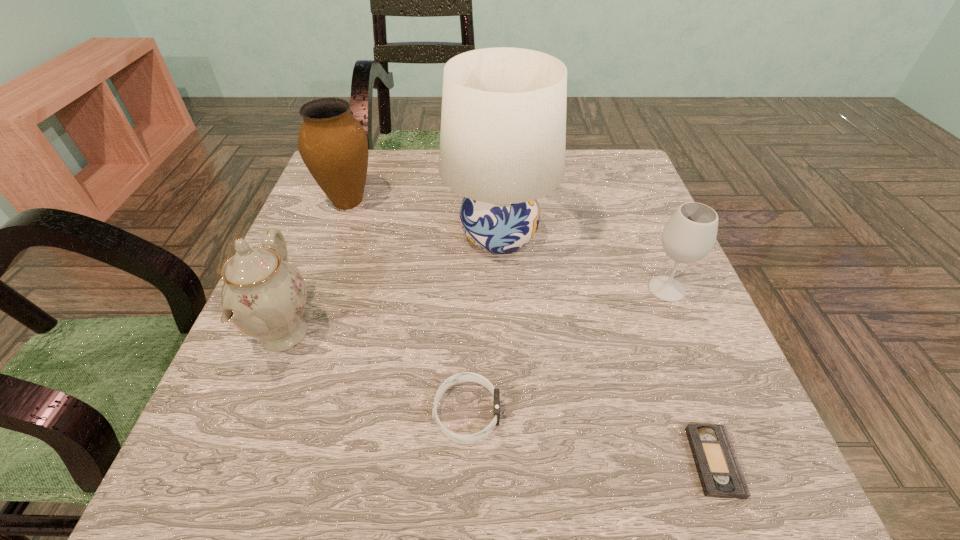
Find the location of a particular element. free region located 0.370m on the spout of the chinaware is located at coordinates (526, 334).

This screenshot has width=960, height=540. I want to click on vacant space situated 0.400m on the left of the fourth tallest object, so [x=441, y=289].

Image resolution: width=960 pixels, height=540 pixels. I want to click on vacant region located on the outer surface of the fifth tallest object, so click(x=726, y=413).

Identify the location of blank space located 0.130m on the back of the shortest object. (674, 356).

Where is `object located in the far edge section of the desktop`? The image size is (960, 540). object located in the far edge section of the desktop is located at coordinates (333, 145).

The height and width of the screenshot is (540, 960). What are the coordinates of `wristband located at the near edge` in the screenshot? It's located at (464, 376).

Find the location of a particular element. videotape positioned at the near edge is located at coordinates click(719, 471).

You are a GUI agent. You are given a task and a screenshot of the screen. Output one action in this format:
    pyautogui.click(x=<x>, y=<y>)
    Task: Click on the urn situated at the left edge
    Image resolution: width=960 pixels, height=540 pixels.
    Given the screenshot: What is the action you would take?
    pyautogui.click(x=333, y=145)

Identify the location of chinaware present at the left edge. This screenshot has height=540, width=960. (263, 295).

What are the coordinates of `wineglass located in the right edge section of the desktop` in the screenshot? It's located at (689, 235).